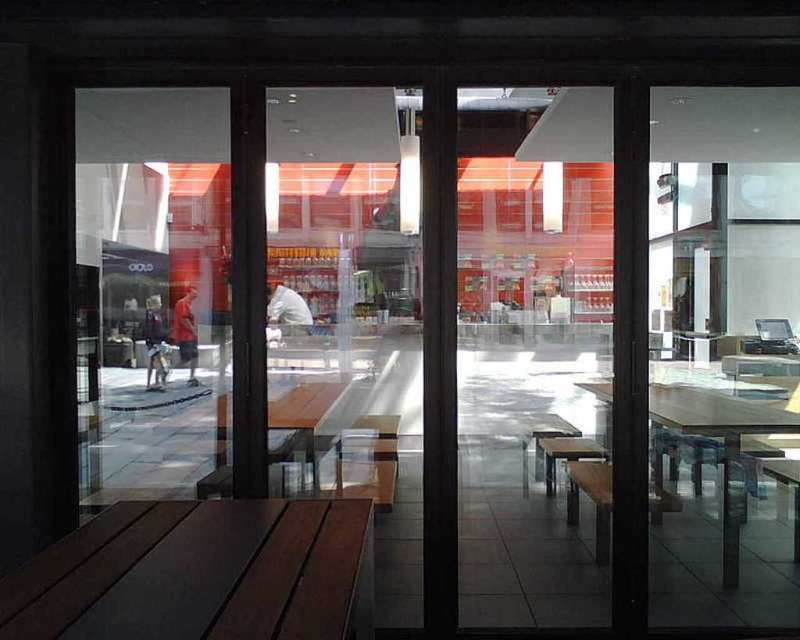
Question: Which is farther from the brown wood table at lower left?

Choices:
 (A) wooden table at center
 (B) transparent glass screen door at center

Answer: (A)

Question: Which of the following is the farthest from the observer?

Choices:
 (A) (165, 134)
 (B) (337, 637)

Answer: (A)

Question: Can you confirm if transparent glass screen door at center is wider than wooden table at center?

Choices:
 (A) yes
 (B) no

Answer: (B)

Question: Considering the relative positions of brown wood table at lower left and wooden table at center in the image provided, where is brown wood table at lower left located with respect to wooden table at center?

Choices:
 (A) above
 (B) below

Answer: (B)

Question: Which point is closer to the camera taking this photo?

Choices:
 (A) (460, 532)
 (B) (160, 573)
 (C) (106, 378)
 (D) (596, 394)

Answer: (B)

Question: In this image, where is transparent glass screen door at center located relative to wooden table at center?

Choices:
 (A) below
 (B) above

Answer: (B)